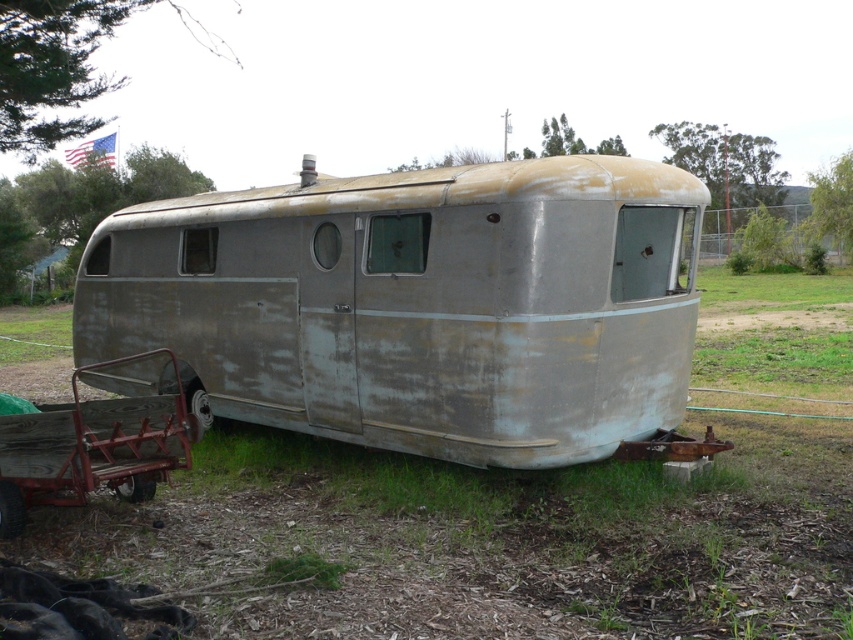
You are standing in front of a rusty metal trailer at center. There is a point marked at coordinates (416, 305). What object is located at that point?

The point at coordinates (416, 305) is where the rusty metal trailer at center is located.

You are standing in front of the rusty metal trailer at center and want to walk to the rusty metal cart at lower left. Which direction should you move to get closer to the cart?

Since the rusty metal trailer at center is further to the viewer than the rusty metal cart at lower left, you should move forward towards the cart, as it is closer to your current position.

You are standing in front of the rusty metal trailer at center and want to place the rusty metal cart at lower left next to it. Considering their heights, will the cart fit under the trailer without being blocked?

The rusty metal trailer at center has a greater height compared to the rusty metal cart at lower left, so the cart can fit under the trailer without being blocked since it is shorter.